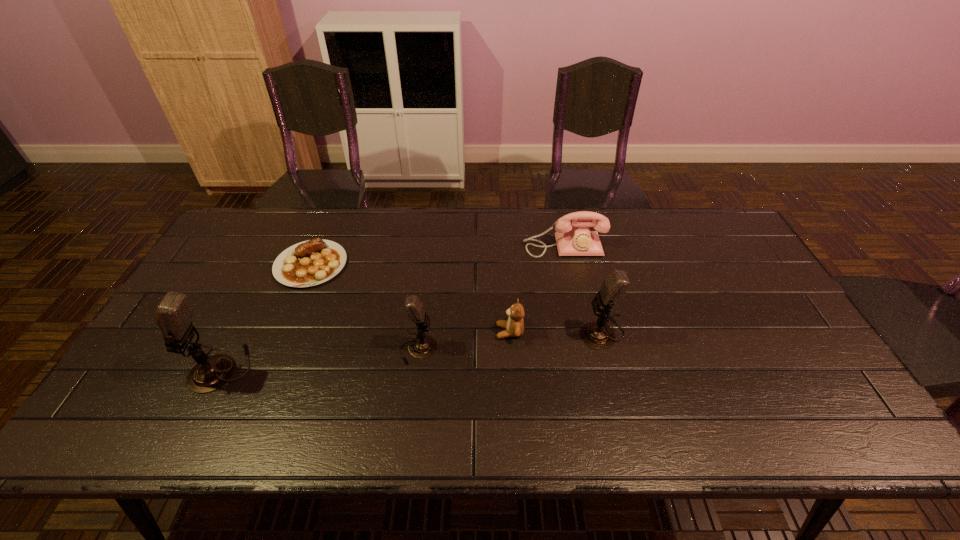
This screenshot has height=540, width=960. What are the coordinates of `free region located 0.100m on the front-facing side of the tallest object` in the screenshot? It's located at (152, 369).

Where is `vacant area situated on the front-facing side of the tallest object`? vacant area situated on the front-facing side of the tallest object is located at coordinates (168, 369).

Identify the location of vacant space located on the front-facing side of the tallest object. (152, 369).

Identify the location of blank area located 0.290m on the front-facing side of the third object from left to right. (548, 349).

Locate an element on the screen. The height and width of the screenshot is (540, 960). vacant space located on the front-facing side of the second shortest microphone is located at coordinates point(479,332).

This screenshot has width=960, height=540. I want to click on vacant area located on the front-facing side of the second shortest microphone, so click(x=539, y=332).

The image size is (960, 540). I want to click on free space located 0.110m on the front-facing side of the second shortest microphone, so click(539, 332).

At what (x,y) coordinates should I click in order to perform the action: click on vacant space located on the right of the shortest object. Please return your answer as a coordinate pair (x, y). Looking at the image, I should click on (442, 265).

This screenshot has width=960, height=540. I want to click on blank space located on the front-facing side of the third object from right to left, so click(404, 332).

Image resolution: width=960 pixels, height=540 pixels. In order to click on free space located on the front-facing side of the third object from right to left in this screenshot , I will do `click(419, 332)`.